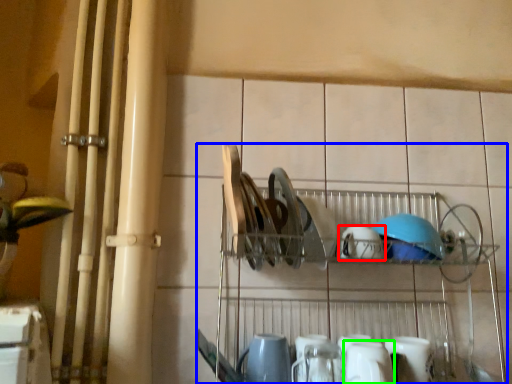
Question: Estimate the real-world distances between objects in this image. Which object is farther from tableware (highlighted by a red box), shelf (highlighted by a blue box) or tableware (highlighted by a green box)?

Choices:
 (A) shelf
 (B) tableware

Answer: (B)